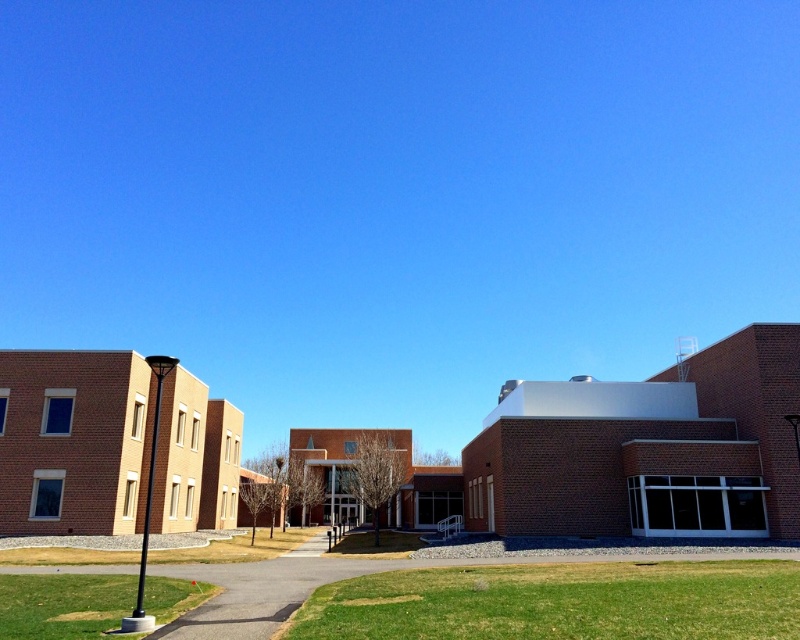
Question: Which point is closer to the camera?

Choices:
 (A) (720, 564)
 (B) (645, 481)

Answer: (A)

Question: Considering the relative positions of green grass at lower center and gravel paved path at lower center in the image provided, where is green grass at lower center located with respect to gravel paved path at lower center?

Choices:
 (A) below
 (B) above

Answer: (B)

Question: Can you confirm if brick building at center is wider than green grass at lower left?

Choices:
 (A) yes
 (B) no

Answer: (A)

Question: Is green grass at lower center smaller than green grass at lower left?

Choices:
 (A) yes
 (B) no

Answer: (B)

Question: Among these objects, which one is nearest to the camera?

Choices:
 (A) green grass at lower left
 (B) gravel paved path at lower center

Answer: (B)

Question: Which of the following is the farthest from the observer?

Choices:
 (A) green grass at lower left
 (B) gravel paved path at lower center
 (C) green grass at lower center

Answer: (A)